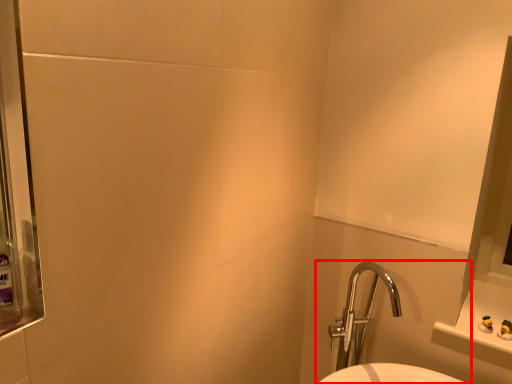
Question: Considering the relative positions of sink (annotated by the red box) and mouthwash in the image provided, where is sink (annotated by the red box) located with respect to the staircase?

Choices:
 (A) left
 (B) right

Answer: (B)